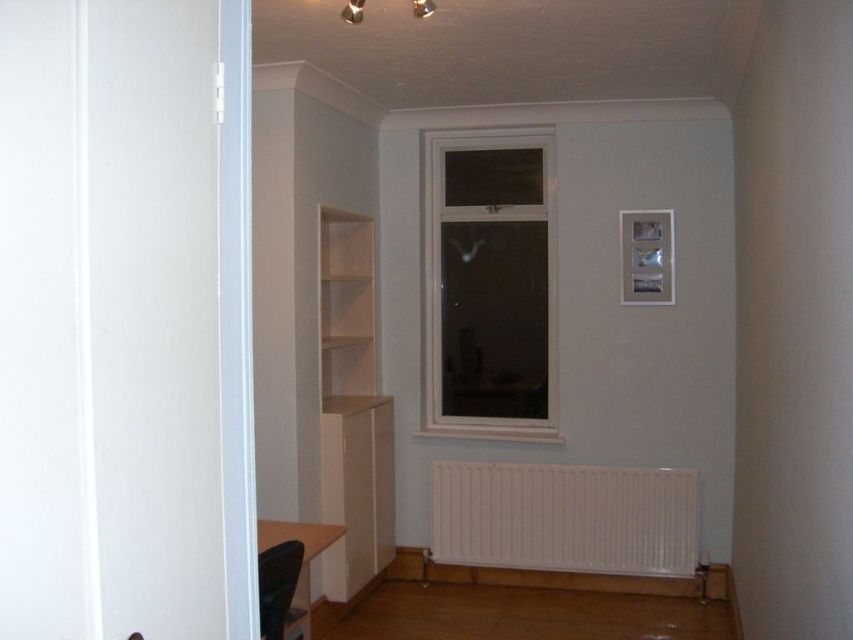
Is white plastic window at center bigger than white matte bookshelf at left?

No, white plastic window at center is not bigger than white matte bookshelf at left.

Based on the photo, who is positioned more to the right, white plastic window at center or white matte bookshelf at left?

white plastic window at center is more to the right.

Find the location of a particular element. The height and width of the screenshot is (640, 853). white plastic window at center is located at coordinates (488, 278).

Measure the distance between white matte radiator at lower center and white matte bookshelf at left.

white matte radiator at lower center and white matte bookshelf at left are 34.12 inches apart.

Does white matte radiator at lower center have a larger size compared to white matte bookshelf at left?

Actually, white matte radiator at lower center might be smaller than white matte bookshelf at left.

Measure the distance between white matte radiator at lower center and camera.

white matte radiator at lower center is 4.10 meters away from camera.

Where is `white matte radiator at lower center`? This screenshot has width=853, height=640. white matte radiator at lower center is located at coordinates (564, 516).

Is white matte bookshelf at left closer to the viewer compared to light wood shelf at upper center?

That is True.

Does white matte bookshelf at left lie behind light wood shelf at upper center?

That is False.

The height and width of the screenshot is (640, 853). What are the coordinates of `white matte bookshelf at left` in the screenshot? It's located at (352, 408).